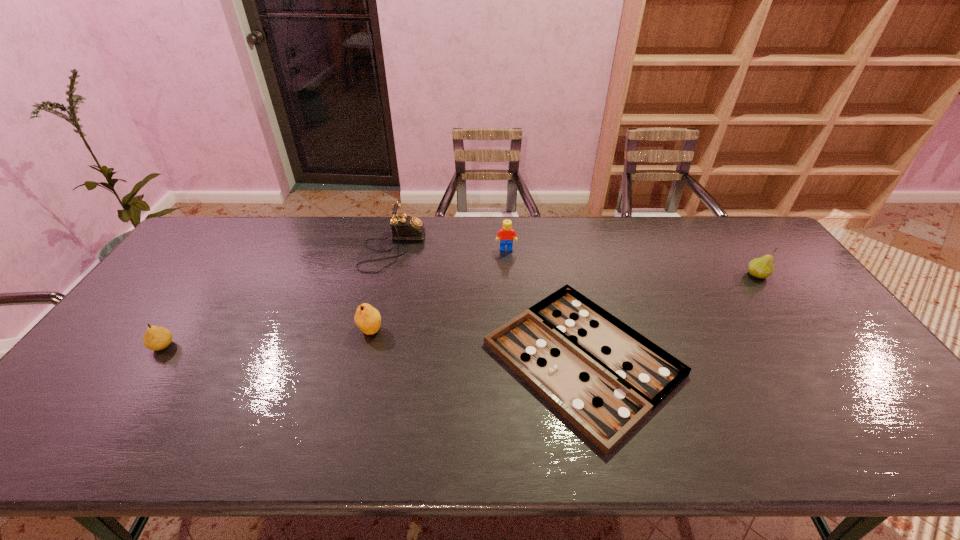
You are a GUI agent. You are given a task and a screenshot of the screen. Output one action in this format:
    pyautogui.click(x=<x>, y=<y>)
    Task: Click on the unoccupied position between the farthest pear and the Lego
    This screenshot has width=960, height=540.
    Given the screenshot: What is the action you would take?
    pyautogui.click(x=632, y=262)

This screenshot has width=960, height=540. I want to click on vacant area between the gameboard and the rightmost object, so click(670, 317).

You are a GUI agent. You are given a task and a screenshot of the screen. Output one action in this format:
    pyautogui.click(x=<x>, y=<y>)
    Task: Click on the second closest object to the shortest object
    The width and height of the screenshot is (960, 540).
    Given the screenshot: What is the action you would take?
    pyautogui.click(x=404, y=227)

Locate an element on the screen. The height and width of the screenshot is (540, 960). object that is the closest to the Lego is located at coordinates (604, 377).

At what (x,y) coordinates should I click in order to perform the action: click on the closest pear to the tallest pear. Please return your answer as a coordinate pair (x, y). Looking at the image, I should click on 367,318.

You are a GUI agent. You are given a task and a screenshot of the screen. Output one action in this format:
    pyautogui.click(x=<x>, y=<y>)
    Task: Click on the pear that is the third closest to the shortest object
    This screenshot has height=540, width=960.
    Given the screenshot: What is the action you would take?
    pyautogui.click(x=156, y=338)

Find the location of a particular element. vacant position in the image that satisfies the following two spatial constraints: 1. on the back side of the tallest pear; 2. on the right side of the leftmost pear is located at coordinates (213, 275).

The height and width of the screenshot is (540, 960). What are the coordinates of `vacant space that satisfies the following two spatial constraints: 1. on the back side of the tallest pear; 2. on the dial of the telephone` in the screenshot? It's located at [738, 248].

Locate an element on the screen. The image size is (960, 540). vacant space that satisfies the following two spatial constraints: 1. on the face of the gameboard; 2. on the left side of the Lego is located at coordinates (515, 359).

At what (x,y) coordinates should I click in order to perform the action: click on free spot that satisfies the following two spatial constraints: 1. on the dial of the telephone; 2. on the left side of the rightmost pear. Please return your answer as a coordinate pair (x, y). This screenshot has width=960, height=540. Looking at the image, I should click on coord(386,275).